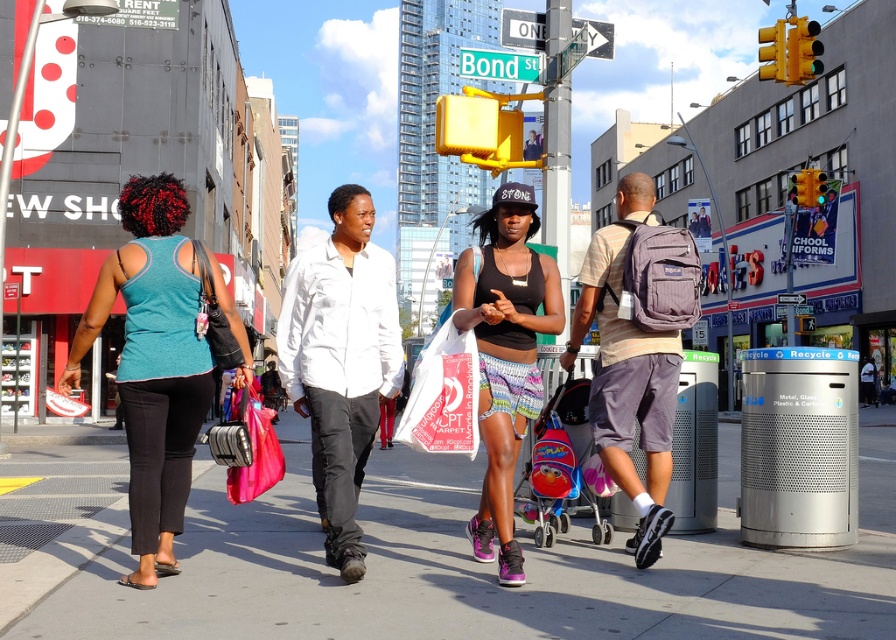
Question: Does white matte shirt at center lie behind matte black tank top at center?

Choices:
 (A) no
 (B) yes

Answer: (A)

Question: Which object is positioned closest to the matte purple backpack at center right?

Choices:
 (A) gray concrete sidewalk at center
 (B) matte black tank top at center
 (C) teal fabric tank top at center
 (D) white matte shirt at center

Answer: (B)

Question: Which point is closer to the camera taking this photo?

Choices:
 (A) (154, 368)
 (B) (297, 291)

Answer: (A)

Question: Is gray concrete sidewalk at center bigger than matte black tank top at center?

Choices:
 (A) no
 (B) yes

Answer: (B)

Question: Which object is closer to the camera taking this photo?

Choices:
 (A) white plastic bag at center
 (B) white matte shirt at center
 (C) matte black tank top at center
 (D) gray concrete sidewalk at center

Answer: (D)

Question: From the image, what is the correct spatial relationship of matte purple backpack at center right in relation to white plastic bag at center?

Choices:
 (A) above
 (B) below

Answer: (A)